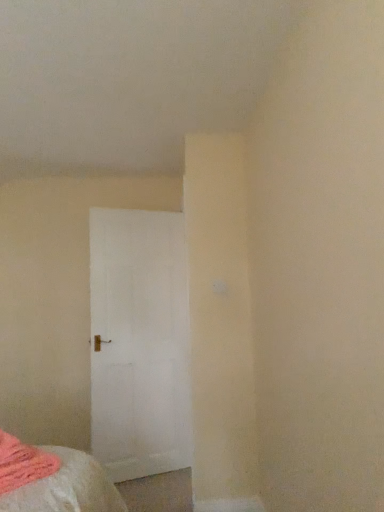
Question: Considering the relative sizes of soft pink fabric at lower left and white matte door at center in the image provided, is soft pink fabric at lower left wider than white matte door at center?

Choices:
 (A) yes
 (B) no

Answer: (A)

Question: Does soft pink fabric at lower left have a smaller size compared to white matte door at center?

Choices:
 (A) yes
 (B) no

Answer: (A)

Question: Is soft pink fabric at lower left to the left of white matte door at center from the viewer's perspective?

Choices:
 (A) yes
 (B) no

Answer: (A)

Question: Can you see soft pink fabric at lower left touching white matte door at center?

Choices:
 (A) no
 (B) yes

Answer: (A)

Question: Is soft pink fabric at lower left positioned beyond the bounds of white matte door at center?

Choices:
 (A) no
 (B) yes

Answer: (B)

Question: From a real-world perspective, is soft pink fabric at lower left located beneath white matte door at center?

Choices:
 (A) no
 (B) yes

Answer: (B)

Question: From a real-world perspective, does white matte door at center sit lower than soft pink fabric at lower left?

Choices:
 (A) no
 (B) yes

Answer: (A)

Question: From the image's perspective, would you say white matte door at center is positioned over soft pink fabric at lower left?

Choices:
 (A) yes
 (B) no

Answer: (A)

Question: Can you confirm if white matte door at center is thinner than soft pink fabric at lower left?

Choices:
 (A) no
 (B) yes

Answer: (B)

Question: Can you confirm if white matte door at center is taller than soft pink fabric at lower left?

Choices:
 (A) no
 (B) yes

Answer: (B)

Question: Is white matte door at center facing towards soft pink fabric at lower left?

Choices:
 (A) yes
 (B) no

Answer: (B)

Question: Is white matte door at center to the left of soft pink fabric at lower left from the viewer's perspective?

Choices:
 (A) yes
 (B) no

Answer: (B)

Question: Is soft pink fabric at lower left inside or outside of white matte door at center?

Choices:
 (A) outside
 (B) inside

Answer: (A)